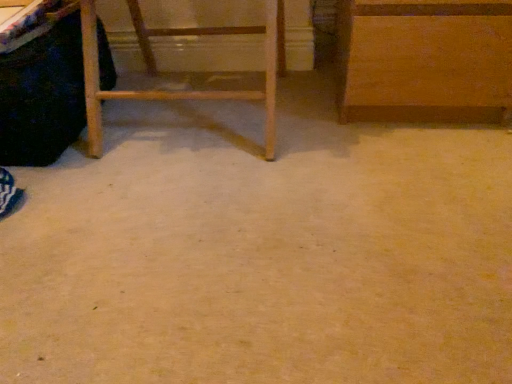
You are a GUI agent. You are given a task and a screenshot of the screen. Output one action in this format:
    pyautogui.click(x=<x>, y=<y>)
    Task: Click on the free spot in front of wooden cabinet at upper right, arranged as the first furniture when viewed from the right
    The height and width of the screenshot is (384, 512).
    Given the screenshot: What is the action you would take?
    pyautogui.click(x=404, y=178)